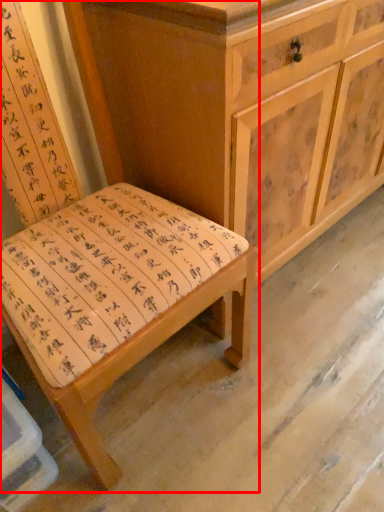
Question: From the image, what is the correct spatial relationship of chair (annotated by the red box) in relation to chest of drawers?

Choices:
 (A) right
 (B) left

Answer: (B)